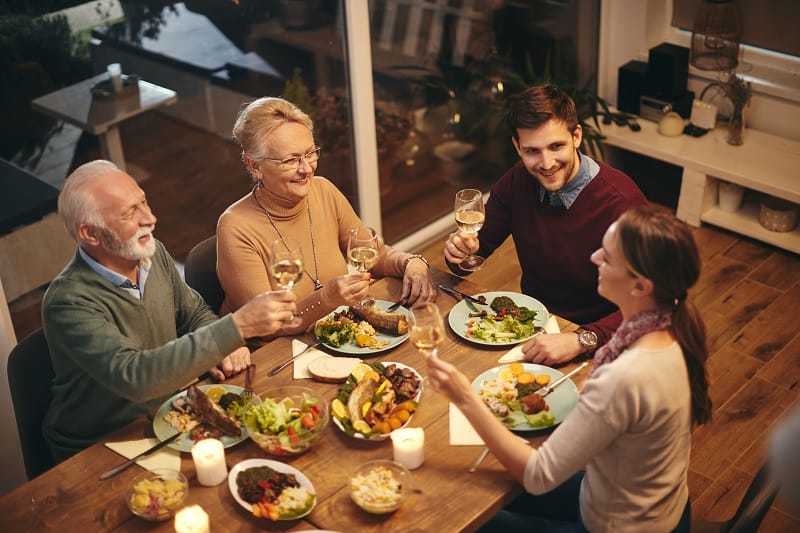
Identify the location of white wine in wine glass. (474, 209), (360, 243), (417, 317), (278, 257).